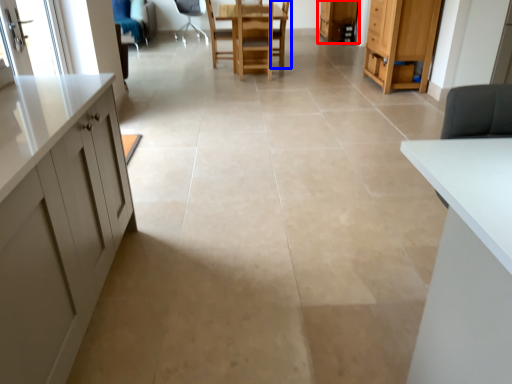
Question: Which point is closer to the camera, cabinetry (highlighted by a red box) or armchair (highlighted by a blue box)?

Choices:
 (A) cabinetry
 (B) armchair

Answer: (B)